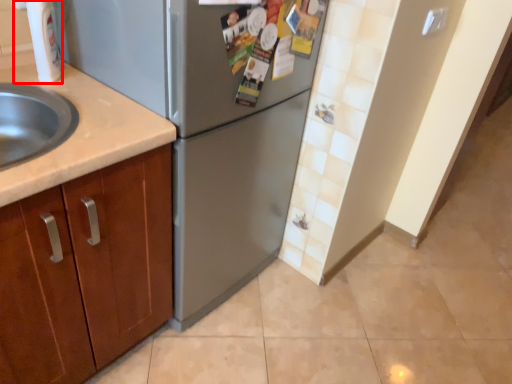
Question: From the image's perspective, where is faucet (annotated by the red box) located in relation to refrigerator in the image?

Choices:
 (A) below
 (B) above

Answer: (B)